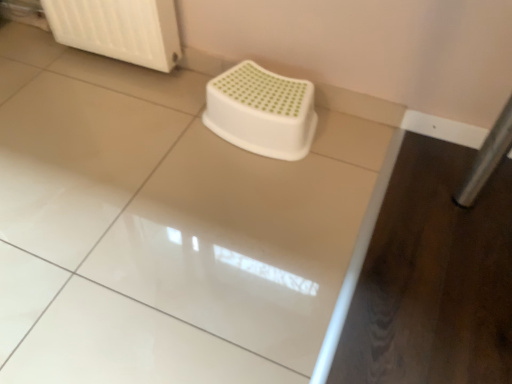
At what (x,y) coordinates should I click in order to perform the action: click on vacant space in between white plastic stool at center and white plastic radiator at upper left. Please return your answer as a coordinate pair (x, y). Image resolution: width=512 pixels, height=384 pixels. Looking at the image, I should click on (134, 89).